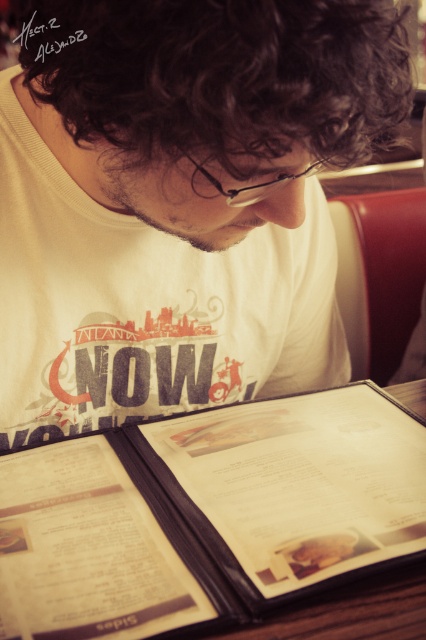
Question: Based on their relative distances, which object is farther from the white matte t-shirt at center?

Choices:
 (A) clear plastic glasses at center
 (B) beige paper menu at lower center

Answer: (B)

Question: Does brown leather menu at lower center appear under beige paper menu at lower center?

Choices:
 (A) no
 (B) yes

Answer: (A)

Question: Which of these objects is positioned farthest from the white matte t-shirt at center?

Choices:
 (A) clear plastic glasses at center
 (B) beige paper menu at lower center

Answer: (B)

Question: Does beige paper menu at lower center appear under clear plastic glasses at center?

Choices:
 (A) no
 (B) yes

Answer: (B)

Question: Is brown leather menu at lower center positioned in front of clear plastic glasses at center?

Choices:
 (A) no
 (B) yes

Answer: (B)

Question: Which of these objects is positioned closest to the brown leather menu at lower center?

Choices:
 (A) white matte t-shirt at center
 (B) clear plastic glasses at center
 (C) beige paper menu at lower center

Answer: (C)